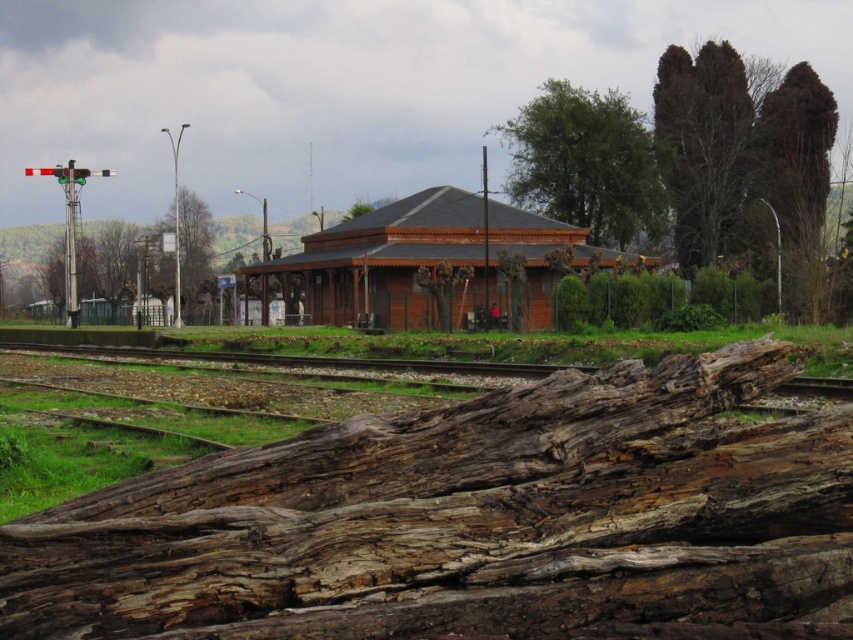
You are a visitor at the brown wooden railway station at center and want to take a photo of the green leafy tree at upper right. Will the tree appear larger or smaller in your photo compared to the station?

The green leafy tree at upper right is larger in size than the brown wooden railway station at center, so in the photo, the tree will appear larger than the station.

You are a railway worker standing at the brown wooden railway station at center and need to reach the green leafy tree at upper center to inspect its roots. Can you walk directly to the tree without crossing any tracks?

The distance between the brown wooden railway station at center and the green leafy tree at upper center is 20.04 meters. Since there are no tracks mentioned in the scene description between them, you can walk directly to the tree.

You are a maintenance worker needing to access the brown wooden railway station at center. There is a weathered wood log at center blocking your path. Can you step over it without detouring around?

The weathered wood log at center is below brown wooden railway station at center, but the description does not specify the log height. Without knowing the log height, it is impossible to determine if you can step over it.